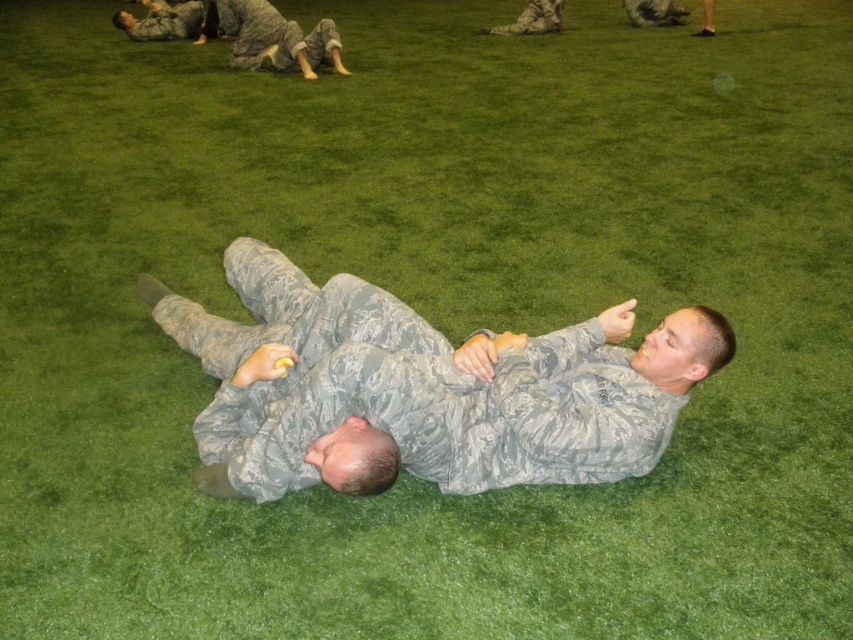
Question: Does camouflage fabric man at upper center have a larger size compared to camouflage uniform at upper center?

Choices:
 (A) no
 (B) yes

Answer: (B)

Question: Is camouflage fabric man at center to the right of camouflage fabric man at upper center from the viewer's perspective?

Choices:
 (A) yes
 (B) no

Answer: (A)

Question: Which point is farther to the camera?

Choices:
 (A) (543, 0)
 (B) (181, 6)
 (C) (306, 76)
 (D) (648, 360)

Answer: (A)

Question: Among these points, which one is farthest from the camera?

Choices:
 (A) (170, 36)
 (B) (325, 33)
 (C) (466, 483)
 (D) (538, 1)

Answer: (D)

Question: Estimate the real-world distances between objects in this image. Which object is closer to the camouflage uniform at upper left?

Choices:
 (A) camouflage uniform at upper center
 (B) camouflage fabric man at upper center

Answer: (B)

Question: Considering the relative positions of camouflage fabric man at upper center and camouflage uniform at upper center in the image provided, where is camouflage fabric man at upper center located with respect to camouflage uniform at upper center?

Choices:
 (A) above
 (B) below

Answer: (B)